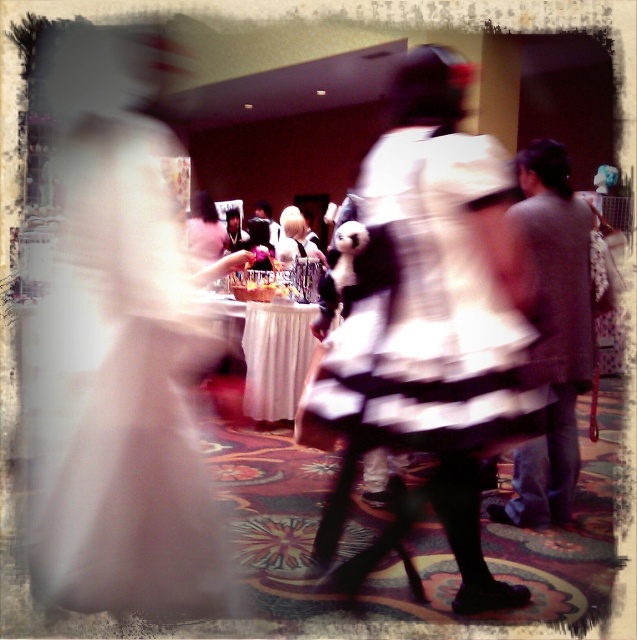
Does white satin dress at left come behind white striped dress at center?

No, white satin dress at left is closer to the viewer.

Is white satin dress at left closer to the viewer compared to white striped dress at center?

Yes, it is in front of white striped dress at center.

Who is more distant from viewer, (117, 356) or (380, 381)?

Positioned behind is point (380, 381).

Locate an element on the screen. white satin dress at left is located at coordinates (127, 392).

In the scene shown: Between white satin dress at left and blonde hair at center, which one is positioned higher?

Positioned higher is blonde hair at center.

Is white satin dress at left shorter than blonde hair at center?

No.

Which is in front, point (166, 262) or point (289, 241)?

Positioned in front is point (166, 262).

Where is `white satin dress at left`? white satin dress at left is located at coordinates (127, 392).

Is point (445, 253) closer to viewer compared to point (292, 227)?

Yes, it is.

Can you confirm if white striped dress at center is positioned to the right of blonde hair at center?

Indeed, white striped dress at center is positioned on the right side of blonde hair at center.

I want to click on white striped dress at center, so click(429, 305).